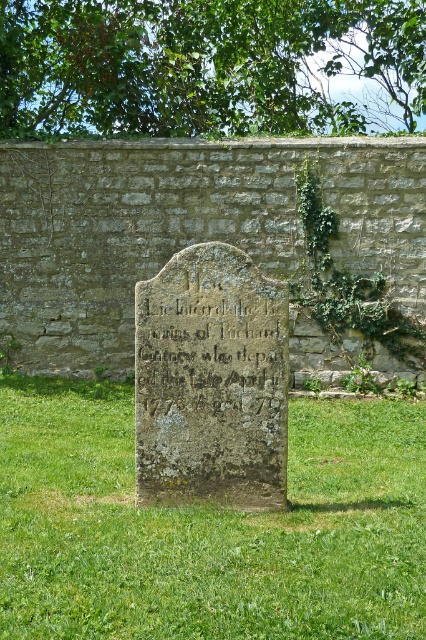
Consider the image. You are standing in front of the gravestone and want to take a photo. There are two points marked on the gravestone. One is at coordinates point (164, 484) and the other is at point (226, 413). Which point is closer to you when you are facing the gravestone?

Point (164, 484) is further to the camera than point (226, 413), so the point closer to you is point (226, 413).

You are a historian examining the gravestone. You notice two features on it. The green mossy stone at center and the carved stone inscription at center. Which one is located lower on the gravestone?

The green mossy stone at center is located below the carved stone inscription at center, so it is lower on the gravestone.